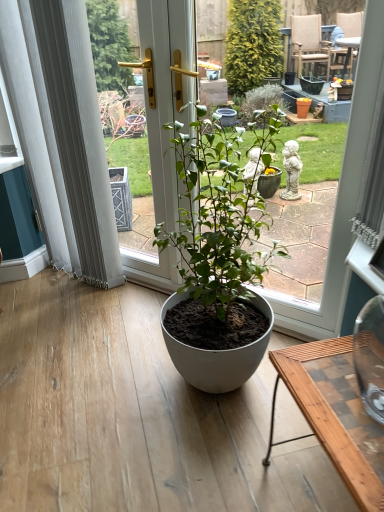
Question: Choose the correct answer: Is wooden desk at lower right inside matte white pot at center or outside it?

Choices:
 (A) inside
 (B) outside

Answer: (B)

Question: Considering the relative positions of wooden desk at lower right and matte white pot at center in the image provided, is wooden desk at lower right to the left or to the right of matte white pot at center?

Choices:
 (A) right
 (B) left

Answer: (A)

Question: Which is farther from the matte white pot at center?

Choices:
 (A) wooden desk at lower right
 (B) matte white pot at center
 (C) white sheer curtain at left

Answer: (C)

Question: Considering the real-world distances, which object is closest to the white sheer curtain at left?

Choices:
 (A) matte white pot at center
 (B) wooden desk at lower right
 (C) matte white pot at center

Answer: (A)